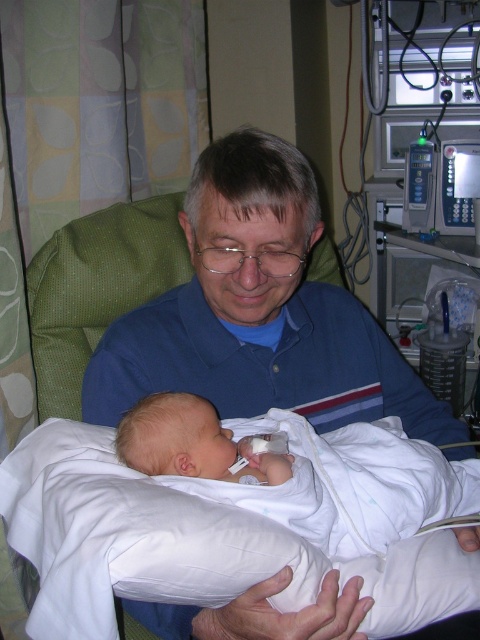
You are a nurse in a hospital room. You need to place a small medical kit between the blue cotton shirt at center and the white soft swaddled newborn at center. Can you fit it there?

The blue cotton shirt at center might be wider than the white soft swaddled newborn at center, so there may not be enough space to fit the medical kit between them.

You are a healthcare professional entering the hospital room and need to check the baby. The blue cotton shirt at center is blocking your view. Can you see the white soft swaddled newborn at center without moving the shirt?

The white soft swaddled newborn at center is behind the blue cotton shirt at center, so you cannot see the newborn without moving the shirt.